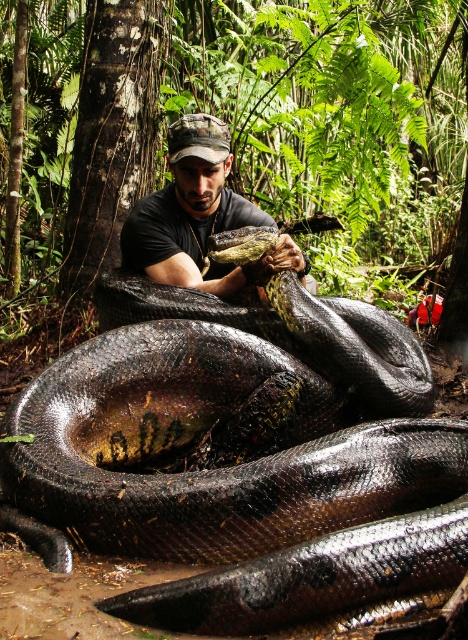
Question: Which object appears closest to the camera in this image?

Choices:
 (A) matte black shirt at center
 (B) shiny black snake at center

Answer: (B)

Question: Which point is closer to the camera taking this photo?

Choices:
 (A) (453, 508)
 (B) (258, 273)

Answer: (A)

Question: In this image, where is shiny black snake at center located relative to matte black shirt at center?

Choices:
 (A) right
 (B) left

Answer: (A)

Question: Can you confirm if shiny black snake at center is positioned to the right of matte black shirt at center?

Choices:
 (A) yes
 (B) no

Answer: (A)

Question: Among these objects, which one is nearest to the camera?

Choices:
 (A) shiny black snake at center
 (B) matte black shirt at center

Answer: (A)

Question: In this image, where is shiny black snake at center located relative to matte black shirt at center?

Choices:
 (A) right
 (B) left

Answer: (A)